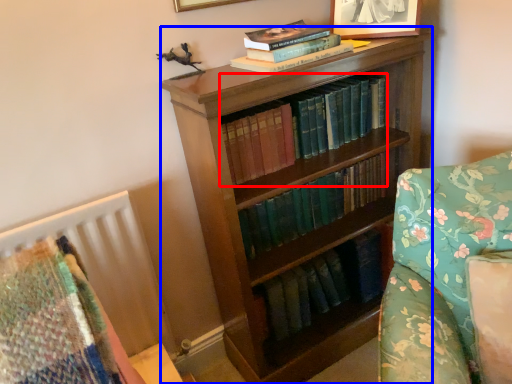
Question: Which object is closer to the camera taking this photo, book (highlighted by a red box) or bookcase (highlighted by a blue box)?

Choices:
 (A) book
 (B) bookcase

Answer: (B)